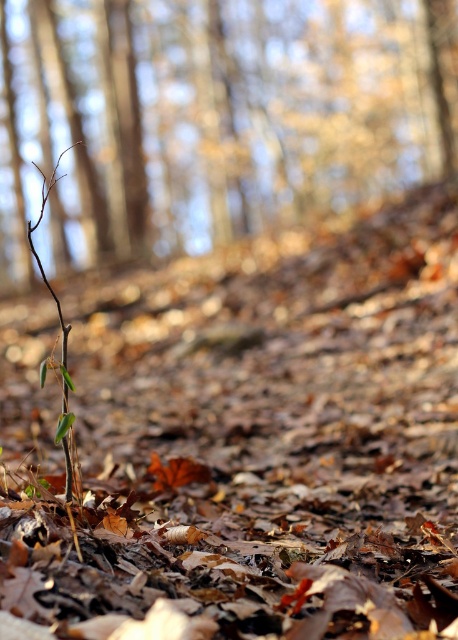
Question: Which object appears farthest from the camera in this image?

Choices:
 (A) brown dry leaves at center
 (B) brown matte branch at left

Answer: (B)

Question: Which of the following is the closest to the observer?

Choices:
 (A) brown dry leaves at center
 (B) brown matte branch at left

Answer: (A)

Question: Is brown dry leaves at center above brown matte branch at left?

Choices:
 (A) no
 (B) yes

Answer: (A)

Question: Is brown dry leaves at center above brown matte branch at left?

Choices:
 (A) yes
 (B) no

Answer: (B)

Question: Which object appears closest to the camera in this image?

Choices:
 (A) brown dry leaves at center
 (B) brown matte branch at left

Answer: (A)

Question: Is brown dry leaves at center bigger than brown matte branch at left?

Choices:
 (A) no
 (B) yes

Answer: (A)